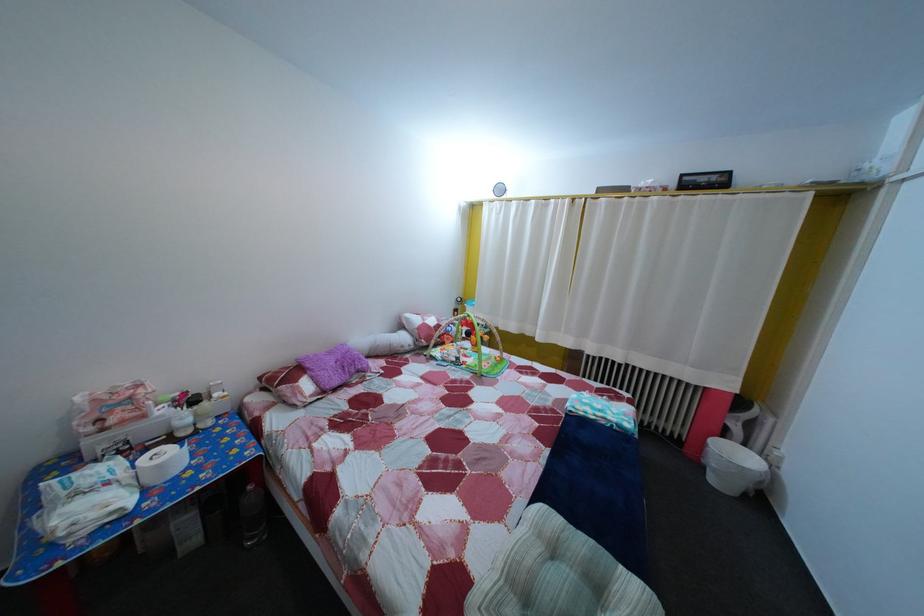
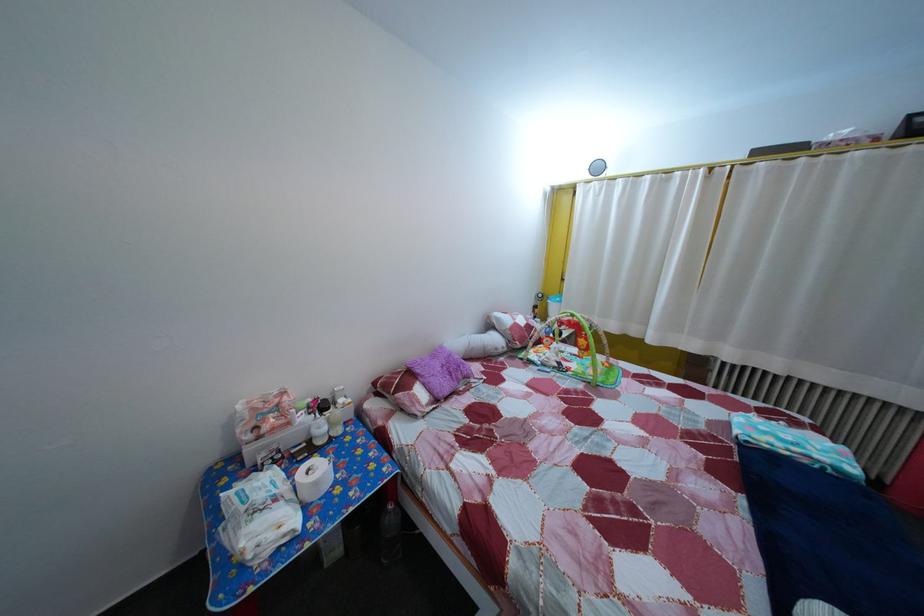
In the second image, find the point that corresponds to point (322, 386) in the first image.

(433, 392)